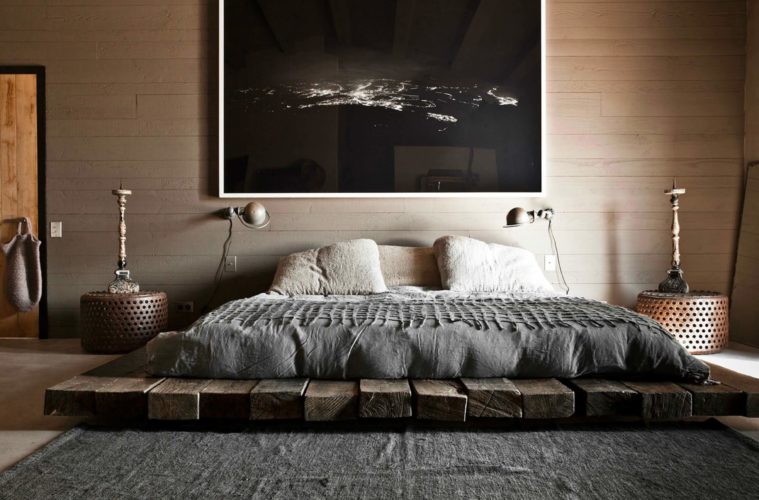
At what (x,y) coordinates should I click in order to perform the action: click on light. Please return your answer as a coordinate pair (x, y). Looking at the image, I should click on (515, 212).